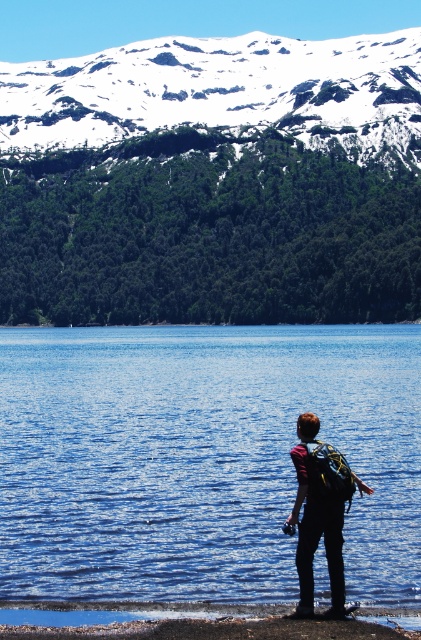
In the scene shown: Is blue liquid water at lower center behind matte black backpack at center?

Yes, it is.

Between point (170, 406) and point (341, 522), which one is positioned behind?

Point (170, 406)

Locate an element on the screen. blue liquid water at lower center is located at coordinates (200, 458).

Does blue liquid water at lower center have a greater width compared to snowy rock mountain at upper center?

Incorrect, blue liquid water at lower center's width does not surpass snowy rock mountain at upper center's.

Does point (132, 515) come closer to viewer compared to point (167, 97)?

Yes, it is in front of point (167, 97).

You are a GUI agent. You are given a task and a screenshot of the screen. Output one action in this format:
    pyautogui.click(x=<x>, y=<y>)
    Task: Click on the blue liquid water at lower center
    The image size is (421, 640).
    Given the screenshot: What is the action you would take?
    pyautogui.click(x=200, y=458)

Does snowy rock mountain at upper center appear on the right side of smooth sand shoreline at lower center?

No, snowy rock mountain at upper center is not to the right of smooth sand shoreline at lower center.

Is snowy rock mountain at upper center wider than smooth sand shoreline at lower center?

Correct, the width of snowy rock mountain at upper center exceeds that of smooth sand shoreline at lower center.

Where is `snowy rock mountain at upper center`? snowy rock mountain at upper center is located at coordinates (223, 92).